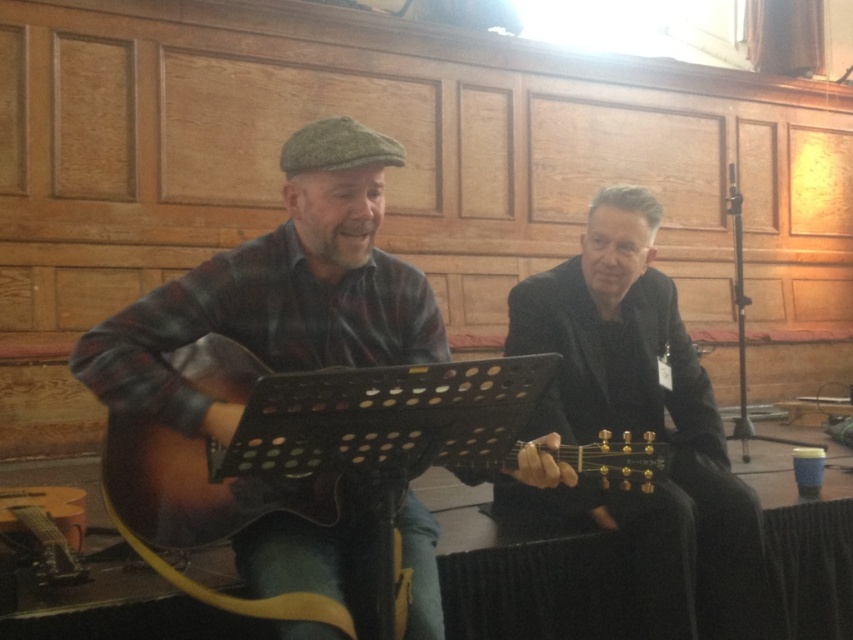
You are a photographer setting up for a session with two matte brown guitars. You notice the matte brown guitar at left and the matte brown acoustic guitar at left in the scene. Which guitar is positioned more to the left side of the frame?

The matte brown guitar at left is positioned more to the left side of the frame compared to the matte brown acoustic guitar at left.

You are a photographer setting up for a shoot. You need to position a light source so that it illuminates the shiny black guitar at center without casting a shadow over the matte brown guitar at left. Based on their positions, where should you place the light source relative to the guitars?

Since the matte brown guitar at left is in front of the shiny black guitar at center, placing the light source behind the matte brown guitar at left would cast its shadow away from the shiny black guitar at center, ensuring the light illuminates the shiny black guitar at center without shadowing it.

Consider the image. You are a photographer setting up for a shoot. You need to position a light to the right of the shiny black guitar at center so it doesn t cast a shadow on the matte brown guitar at left. Where should you place the light?

Place the light to the right of the shiny black guitar at center. Since the matte brown guitar at left is to the left of the shiny black guitar at center, positioning the light to the right ensures it won t cast a shadow on the matte brown guitar at left.